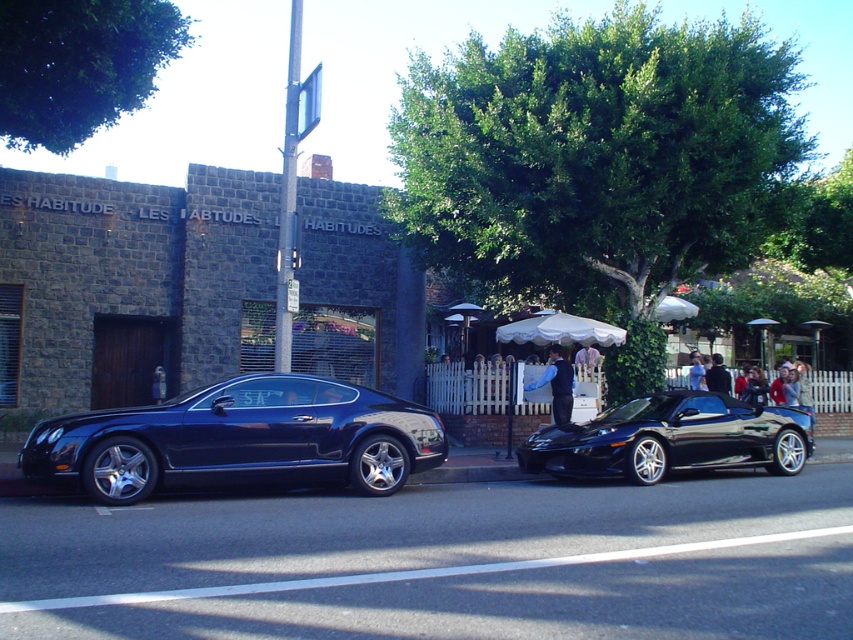
Question: Is the position of shiny dark blue car at left less distant than that of dark blue leather jacket at center?

Choices:
 (A) yes
 (B) no

Answer: (A)

Question: Which object appears farthest from the camera in this image?

Choices:
 (A) black metallic sports car at right
 (B) dark blue leather jacket at center
 (C) blue velvet vest at center

Answer: (B)

Question: Which object is closer to the camera taking this photo?

Choices:
 (A) dark blue leather jacket at center
 (B) light brown leather jacket at center

Answer: (A)

Question: Which point is farther to the camera?

Choices:
 (A) (247, 461)
 (B) (709, 385)
 (C) (697, 378)

Answer: (C)

Question: Can you confirm if dark blue leather jacket at center is smaller than light brown leather jacket at center?

Choices:
 (A) no
 (B) yes

Answer: (A)

Question: Is shiny dark blue car at left to the right of blue velvet vest at center from the viewer's perspective?

Choices:
 (A) yes
 (B) no

Answer: (B)